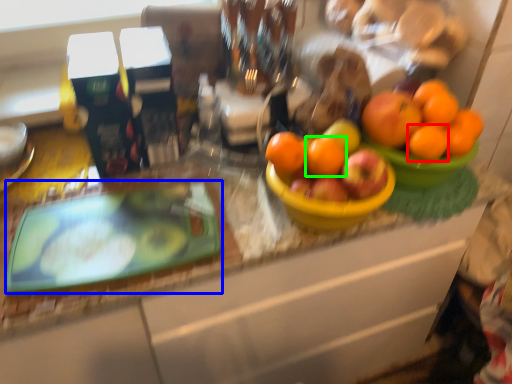
Question: Based on their relative distances, which object is farther from orange (highlighted by a red box)? Choose from glass plate (highlighted by a blue box) and orange (highlighted by a green box).

Choices:
 (A) glass plate
 (B) orange

Answer: (A)